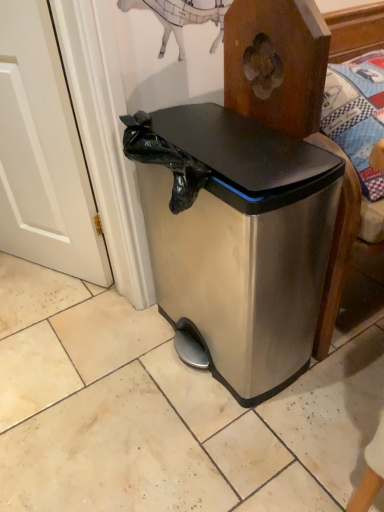
I want to click on white wood door at left, so [x=42, y=153].

What is the approximate width of white wood door at left?

The width of white wood door at left is 4.04 inches.

The height and width of the screenshot is (512, 384). Describe the element at coordinates (42, 153) in the screenshot. I see `white wood door at left` at that location.

What is the approximate width of stainless steel trash can at center?

stainless steel trash can at center is 13.60 inches wide.

Describe the element at coordinates (237, 238) in the screenshot. I see `stainless steel trash can at center` at that location.

Locate an element on the screen. stainless steel trash can at center is located at coordinates (237, 238).

I want to click on white wood door at left, so click(x=42, y=153).

Consider the image. Can you confirm if stainless steel trash can at center is positioned to the left of white wood door at left?

In fact, stainless steel trash can at center is to the right of white wood door at left.

Is stainless steel trash can at center in front of or behind white wood door at left in the image?

stainless steel trash can at center is positioned closer to the viewer than white wood door at left.

Is point (270, 314) closer to camera compared to point (57, 225)?

Yes, point (270, 314) is closer to viewer.

From the image's perspective, is stainless steel trash can at center located above white wood door at left?

Incorrect, from the image's perspective, stainless steel trash can at center is lower than white wood door at left.

From a real-world perspective, is stainless steel trash can at center physically located above or below white wood door at left?

stainless steel trash can at center is below white wood door at left.

Considering the relative sizes of stainless steel trash can at center and white wood door at left in the image provided, is stainless steel trash can at center thinner than white wood door at left?

No.

Considering the sizes of objects stainless steel trash can at center and white wood door at left in the image provided, who is shorter, stainless steel trash can at center or white wood door at left?

stainless steel trash can at center.

Looking at this image, looking at the image, does stainless steel trash can at center seem bigger or smaller compared to white wood door at left?

In the image, stainless steel trash can at center appears to be larger than white wood door at left.

Does stainless steel trash can at center contain white wood door at left?

No, white wood door at left is located outside of stainless steel trash can at center.

Can you see stainless steel trash can at center touching white wood door at left?

stainless steel trash can at center and white wood door at left are clearly separated.

Is stainless steel trash can at center facing towards white wood door at left?

No, stainless steel trash can at center is not turned towards white wood door at left.

At what (x,y) coordinates should I click in order to perform the action: click on screen door positioned vertically above the stainless steel trash can at center (from a real-world perspective). Please return your answer as a coordinate pair (x, y). This screenshot has height=512, width=384. Looking at the image, I should click on (42, 153).

Between white wood door at left and stainless steel trash can at center, which one appears on the right side from the viewer's perspective?

stainless steel trash can at center.

Is white wood door at left in front of stainless steel trash can at center?

No, it is behind stainless steel trash can at center.

Which is less distant, (72,226) or (176,237)?

Point (72,226) appears to be closer to the viewer than point (176,237).

From the image's perspective, between white wood door at left and stainless steel trash can at center, which one is located above?

white wood door at left, from the image's perspective.

From a real-world perspective, is white wood door at left above or below stainless steel trash can at center?

From a real-world perspective, white wood door at left is physically above stainless steel trash can at center.

Which object is thinner, white wood door at left or stainless steel trash can at center?

Thinner between the two is white wood door at left.

Which of these two, white wood door at left or stainless steel trash can at center, stands shorter?

With less height is stainless steel trash can at center.

Can you confirm if white wood door at left is smaller than stainless steel trash can at center?

Indeed, white wood door at left has a smaller size compared to stainless steel trash can at center.

Would you say white wood door at left is outside stainless steel trash can at center?

Yes, white wood door at left is outside of stainless steel trash can at center.

Is white wood door at left directly adjacent to stainless steel trash can at center?

No, white wood door at left is not making contact with stainless steel trash can at center.

Is white wood door at left oriented towards stainless steel trash can at center?

No, white wood door at left is not oriented towards stainless steel trash can at center.

How different are the orientations of white wood door at left and stainless steel trash can at center in degrees?

28 degrees separate the facing orientations of white wood door at left and stainless steel trash can at center.

Measure the distance from white wood door at left to stainless steel trash can at center.

Result: white wood door at left and stainless steel trash can at center are 43.45 centimeters apart.

Image resolution: width=384 pixels, height=512 pixels. I want to click on waste container below the white wood door at left (from the image's perspective), so click(237, 238).

I want to click on waste container in front of the white wood door at left, so click(x=237, y=238).

Identify the location of waste container beneath the white wood door at left (from a real-world perspective). The width and height of the screenshot is (384, 512). (237, 238).